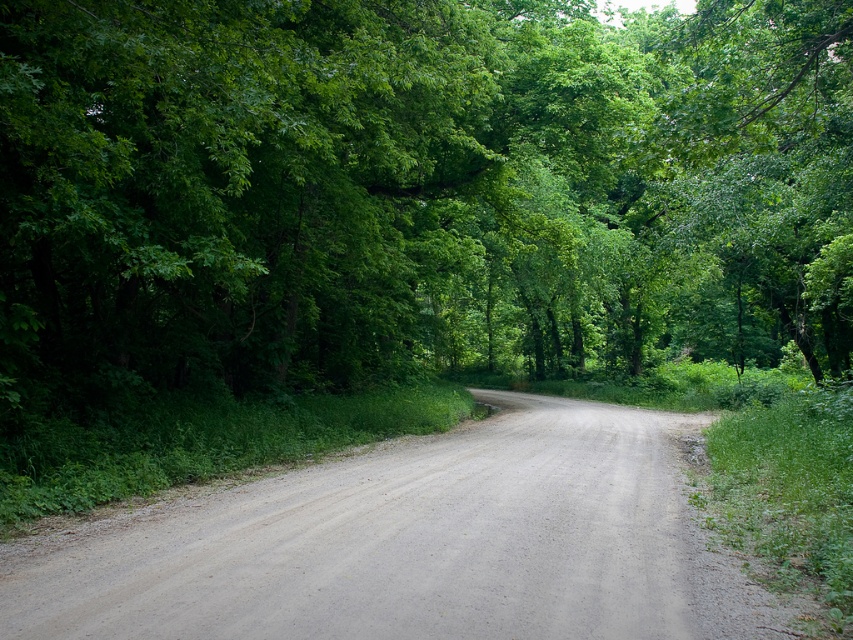
You are a hiker standing at the start of the gray gravel road at center. You want to walk to the green leafy tree at center. Which direction should you turn to reach it?

The green leafy tree at center is to the right of the gray gravel road at center, so you should turn right to reach it.